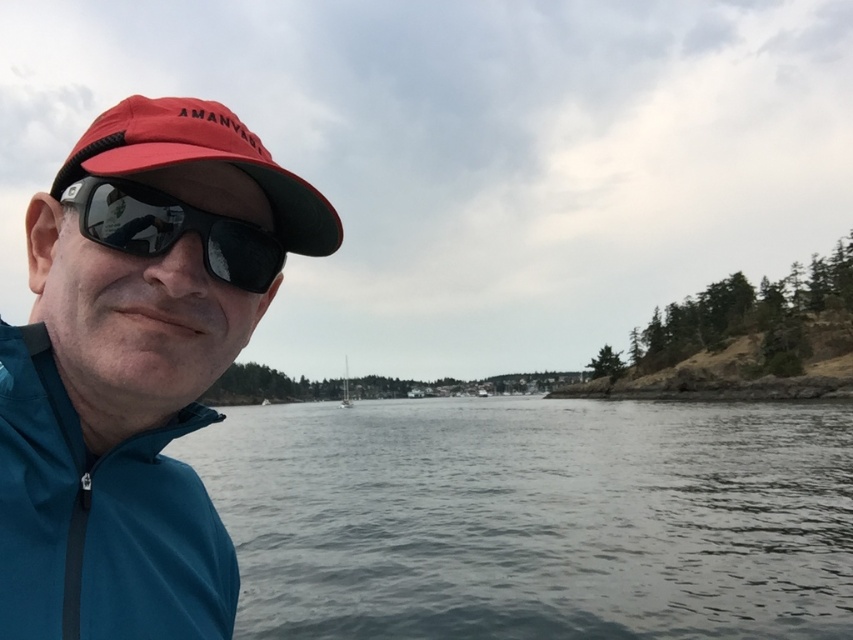
Can you confirm if matte blue jacket at left is thinner than red fabric baseball cap at left?

Yes, matte blue jacket at left is thinner than red fabric baseball cap at left.

Does matte blue jacket at left come behind red fabric baseball cap at left?

No, it is in front of red fabric baseball cap at left.

Who is more forward, (163, 236) or (230, 124)?

Point (163, 236)

At what (x,y) coordinates should I click in order to perform the action: click on matte blue jacket at left. Please return your answer as a coordinate pair (x, y). Looking at the image, I should click on (136, 369).

How far apart are gray water at center and white glossy sailboat at center?

gray water at center and white glossy sailboat at center are 320.41 feet apart.

Between point (383, 628) and point (340, 401), which one is positioned behind?

Point (340, 401)

This screenshot has width=853, height=640. I want to click on gray water at center, so click(x=535, y=518).

Who is positioned more to the right, gray water at center or red fabric baseball cap at left?

From the viewer's perspective, gray water at center appears more on the right side.

What are the coordinates of `gray water at center` in the screenshot? It's located at (535, 518).